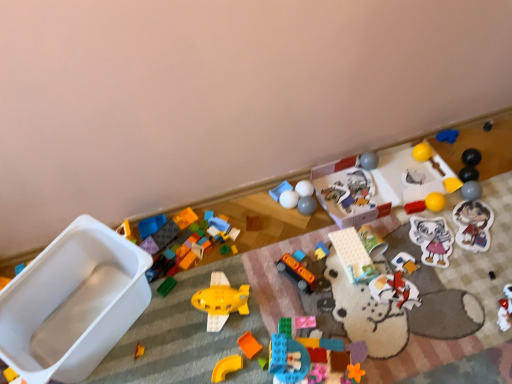
Identify the location of vacant space that's between white glossy sticker at center-right, arranged as the twentieth toy when viewed from the left, and orange matte block at center, which is the twentieth toy from right to left. (360, 288).